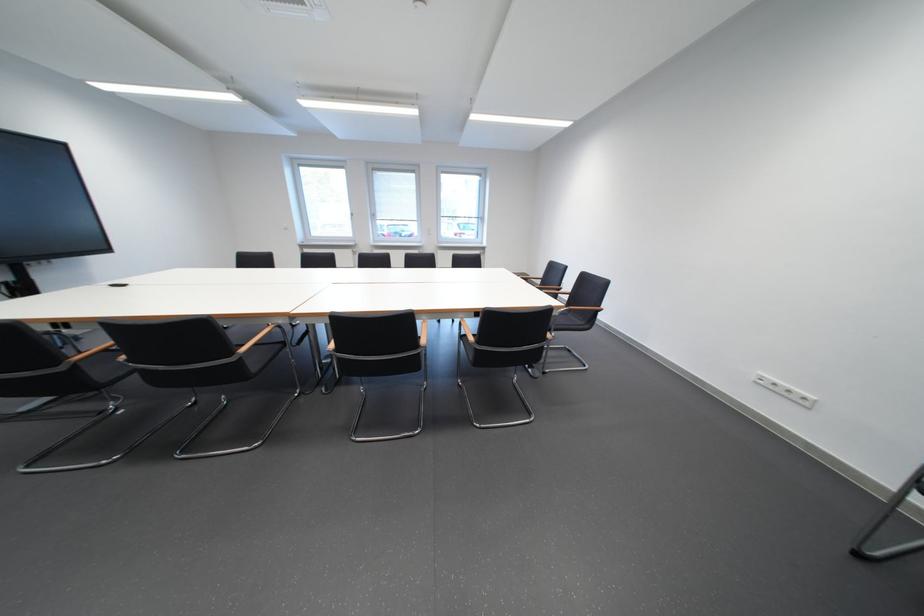
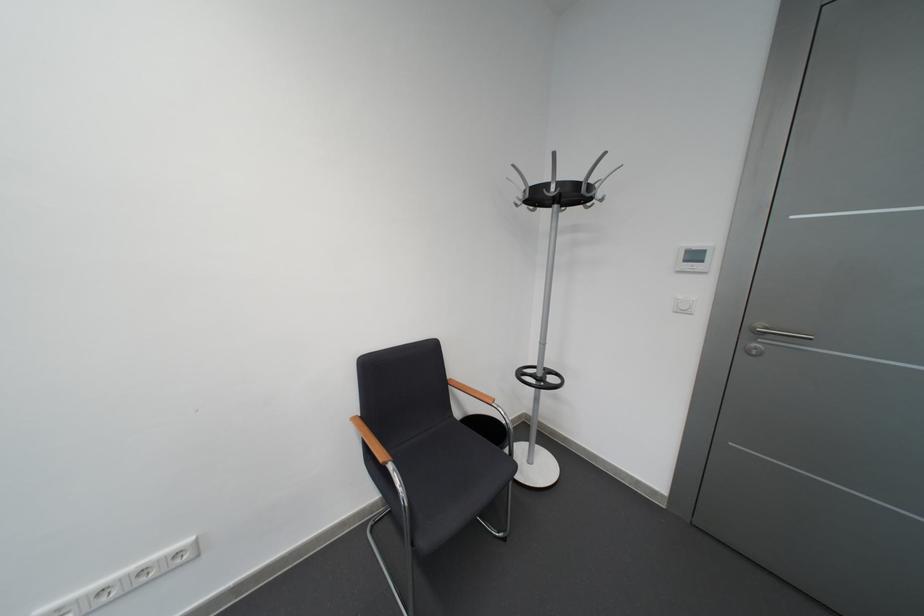
Locate, in the second image, the point that corresponds to (x=818, y=400) in the first image.

(190, 556)